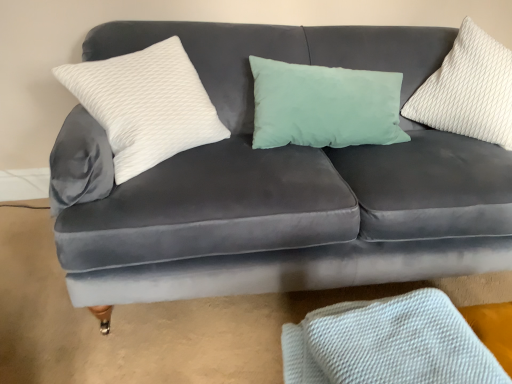
The width and height of the screenshot is (512, 384). Find the location of `white textured pillow at left, the 1th pillow positioned from the left`. white textured pillow at left, the 1th pillow positioned from the left is located at coordinates (145, 105).

I want to click on white textured fabric at lower right, so click(388, 344).

Consider the image. Is white textured pillow at upper right, the second pillow from the left, not within white textured pillow at left, the 1th pillow positioned from the left?

Yes.

Considering the sizes of objects white textured pillow at upper right, the first pillow from the right, and white textured pillow at left, the 2th pillow positioned from the right, in the image provided, who is shorter, white textured pillow at upper right, the first pillow from the right, or white textured pillow at left, the 2th pillow positioned from the right,?

white textured pillow at left, the 2th pillow positioned from the right.

At what (x,y) coordinates should I click in order to perform the action: click on pillow on the left of white textured pillow at upper right, the first pillow from the right. Please return your answer as a coordinate pair (x, y). Looking at the image, I should click on point(145,105).

From the image's perspective, between white textured pillow at upper right, the first pillow from the right, and white textured pillow at left, the 1th pillow positioned from the left, which one is located above?

From the image's view, white textured pillow at upper right, the first pillow from the right, is above.

Can you confirm if white textured fabric at lower right is bigger than white textured pillow at left, the 1th pillow positioned from the left?

No.

Does white textured fabric at lower right appear on the right side of white textured pillow at left, the 1th pillow positioned from the left?

Correct, you'll find white textured fabric at lower right to the right of white textured pillow at left, the 1th pillow positioned from the left.

From the image's perspective, is white textured fabric at lower right under white textured pillow at left, the 2th pillow positioned from the right?

Yes.

Considering the positions of objects white textured fabric at lower right and white textured pillow at left, the 1th pillow positioned from the left, in the image provided, who is in front, white textured fabric at lower right or white textured pillow at left, the 1th pillow positioned from the left,?

white textured fabric at lower right is closer to the camera.

Considering the sizes of objects white textured fabric at lower right and white textured pillow at upper right, the second pillow from the left, in the image provided, who is smaller, white textured fabric at lower right or white textured pillow at upper right, the second pillow from the left,?

With smaller size is white textured fabric at lower right.

From the image's perspective, which is above, white textured fabric at lower right or white textured pillow at upper right, the second pillow from the left?

white textured pillow at upper right, the second pillow from the left.

I want to click on material below the white textured pillow at upper right, the second pillow from the left (from a real-world perspective), so click(x=388, y=344).

Is there a large distance between white textured pillow at upper right, the first pillow from the right, and white textured fabric at lower right?

Yes.

Looking at the image, does white textured pillow at upper right, the first pillow from the right, seem bigger or smaller compared to white textured fabric at lower right?

white textured pillow at upper right, the first pillow from the right, is bigger than white textured fabric at lower right.

From their relative heights in the image, would you say white textured pillow at upper right, the first pillow from the right, is taller or shorter than white textured fabric at lower right?

Considering their sizes, white textured pillow at upper right, the first pillow from the right, has more height than white textured fabric at lower right.

Based on the photo, from the image's perspective, does white textured pillow at left, the 2th pillow positioned from the right, appear lower than white textured fabric at lower right?

No, from the image's perspective, white textured pillow at left, the 2th pillow positioned from the right, is not below white textured fabric at lower right.

Does white textured pillow at left, the 2th pillow positioned from the right, lie behind white textured fabric at lower right?

Yes, it is behind white textured fabric at lower right.

Which of these two, white textured pillow at left, the 1th pillow positioned from the left, or white textured fabric at lower right, stands shorter?

Standing shorter between the two is white textured fabric at lower right.

Can you confirm if white textured pillow at left, the 1th pillow positioned from the left, is thinner than white textured fabric at lower right?

Correct, the width of white textured pillow at left, the 1th pillow positioned from the left, is less than that of white textured fabric at lower right.

Are white textured pillow at left, the 2th pillow positioned from the right, and white textured pillow at upper right, the first pillow from the right, far apart?

No, white textured pillow at left, the 2th pillow positioned from the right, is not far away from white textured pillow at upper right, the first pillow from the right.

Would you say white textured pillow at upper right, the second pillow from the left, is part of white textured pillow at left, the 2th pillow positioned from the right,'s contents?

No, white textured pillow at left, the 2th pillow positioned from the right, does not contain white textured pillow at upper right, the second pillow from the left.

Which is behind, point (133, 175) or point (431, 103)?

The point (431, 103) is farther from the camera.

From the image's perspective, is white textured pillow at left, the 1th pillow positioned from the left, on top of white textured pillow at upper right, the first pillow from the right?

Incorrect, from the image's perspective, white textured pillow at left, the 1th pillow positioned from the left, is lower than white textured pillow at upper right, the first pillow from the right.

Where is `pillow that is under the white textured pillow at upper right, the first pillow from the right (from a real-world perspective)`? pillow that is under the white textured pillow at upper right, the first pillow from the right (from a real-world perspective) is located at coordinates (x=145, y=105).

Identify the location of pillow located on the left of white textured fabric at lower right. (145, 105).

Looking at the image, which one is located closer to white textured fabric at lower right, white textured pillow at left, the 1th pillow positioned from the left, or white textured pillow at upper right, the second pillow from the left?

Based on the image, white textured pillow at left, the 1th pillow positioned from the left, appears to be nearer to white textured fabric at lower right.

Based on their spatial positions, is white textured pillow at upper right, the second pillow from the left, or white textured fabric at lower right further from white textured pillow at left, the 1th pillow positioned from the left?

white textured pillow at upper right, the second pillow from the left, lies further to white textured pillow at left, the 1th pillow positioned from the left, than the other object.

Based on their spatial positions, is white textured pillow at left, the 1th pillow positioned from the left, or white textured fabric at lower right further from white textured pillow at upper right, the first pillow from the right?

white textured fabric at lower right is further to white textured pillow at upper right, the first pillow from the right.

Considering their positions, is white textured fabric at lower right positioned closer to white textured pillow at upper right, the first pillow from the right, than white textured pillow at left, the 2th pillow positioned from the right?

white textured pillow at left, the 2th pillow positioned from the right.

Based on their spatial positions, is white textured fabric at lower right or white textured pillow at upper right, the first pillow from the right, further from white textured pillow at left, the 1th pillow positioned from the left?

Among the two, white textured pillow at upper right, the first pillow from the right, is located further to white textured pillow at left, the 1th pillow positioned from the left.

From the picture: Considering their positions, is white textured pillow at upper right, the first pillow from the right, positioned further to white textured fabric at lower right than white textured pillow at left, the 2th pillow positioned from the right?

Among the two, white textured pillow at upper right, the first pillow from the right, is located further to white textured fabric at lower right.

Image resolution: width=512 pixels, height=384 pixels. In order to click on material located between white textured pillow at left, the 1th pillow positioned from the left, and white textured pillow at upper right, the first pillow from the right, in the left-right direction in this screenshot , I will do `click(388, 344)`.